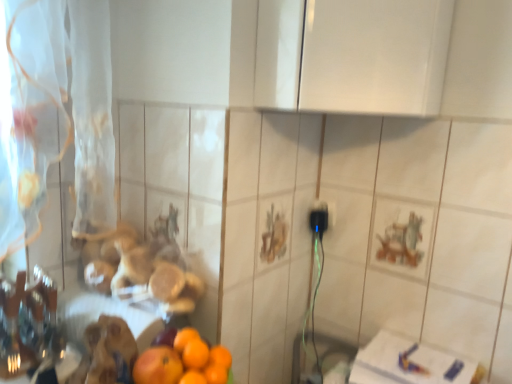
Question: Does point (165, 360) appear closer or farther from the camera than point (0, 218)?

Choices:
 (A) farther
 (B) closer

Answer: (B)

Question: Is orange matte at lower left, acting as the 1th orange starting from the left, in front of or behind white sheer curtain at left in the image?

Choices:
 (A) front
 (B) behind

Answer: (B)

Question: Based on their relative distances, which object is farther from the white sheer curtain at left?

Choices:
 (A) orange matte at lower left, acting as the 1th orange starting from the left
 (B) orange matte at lower left, the first orange viewed from the right

Answer: (B)

Question: Based on their relative distances, which object is nearer to the orange matte at lower left, the first orange viewed from the right?

Choices:
 (A) white sheer curtain at left
 (B) orange matte at lower left, acting as the 1th orange starting from the left

Answer: (B)